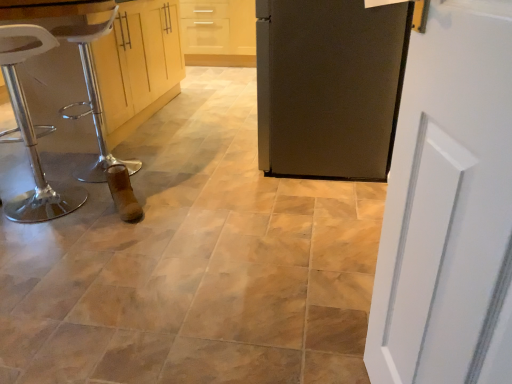
Question: Considering the relative sizes of matte black refrigerator at center, the second door viewed from the left, and white painted wood door at right, the second door viewed from the back, in the image provided, is matte black refrigerator at center, the second door viewed from the left, taller than white painted wood door at right, the second door viewed from the back,?

Choices:
 (A) no
 (B) yes

Answer: (A)

Question: Considering the relative positions of matte black refrigerator at center, which is the 2th door from front to back, and white painted wood door at right, the second door from the top, in the image provided, is matte black refrigerator at center, which is the 2th door from front to back, to the left of white painted wood door at right, the second door from the top, from the viewer's perspective?

Choices:
 (A) no
 (B) yes

Answer: (A)

Question: Considering the relative sizes of matte black refrigerator at center, the 1th door from the top, and white painted wood door at right, the second door viewed from the back, in the image provided, is matte black refrigerator at center, the 1th door from the top, smaller than white painted wood door at right, the second door viewed from the back,?

Choices:
 (A) yes
 (B) no

Answer: (B)

Question: Does matte black refrigerator at center, marked as the first door in a right-to-left arrangement, have a greater width compared to white painted wood door at right, which is the 2th door in right-to-left order?

Choices:
 (A) yes
 (B) no

Answer: (A)

Question: From a real-world perspective, is matte black refrigerator at center, which is the 2th door from front to back, positioned under white painted wood door at right, the second door viewed from the back, based on gravity?

Choices:
 (A) yes
 (B) no

Answer: (A)

Question: From the image's perspective, is matte black refrigerator at center, the 1th door from the top, under white painted wood door at right, the second door viewed from the back?

Choices:
 (A) yes
 (B) no

Answer: (B)

Question: From a real-world perspective, is white plastic bar stool at left physically above white plastic stool at left?

Choices:
 (A) no
 (B) yes

Answer: (B)

Question: Is white plastic bar stool at left completely or partially outside of white plastic stool at left?

Choices:
 (A) no
 (B) yes

Answer: (B)

Question: Can you confirm if white plastic bar stool at left is wider than white plastic stool at left?

Choices:
 (A) yes
 (B) no

Answer: (A)

Question: Can you confirm if white plastic bar stool at left is smaller than white plastic stool at left?

Choices:
 (A) no
 (B) yes

Answer: (A)

Question: Does white plastic bar stool at left have a lesser width compared to white plastic stool at left?

Choices:
 (A) no
 (B) yes

Answer: (A)

Question: Considering the relative positions of white plastic bar stool at left and white plastic stool at left in the image provided, is white plastic bar stool at left to the right of white plastic stool at left from the viewer's perspective?

Choices:
 (A) yes
 (B) no

Answer: (A)

Question: Is white painted wood door at right, the second door from the top, completely or partially outside of matte black refrigerator at center, the 1th door from the top?

Choices:
 (A) yes
 (B) no

Answer: (A)